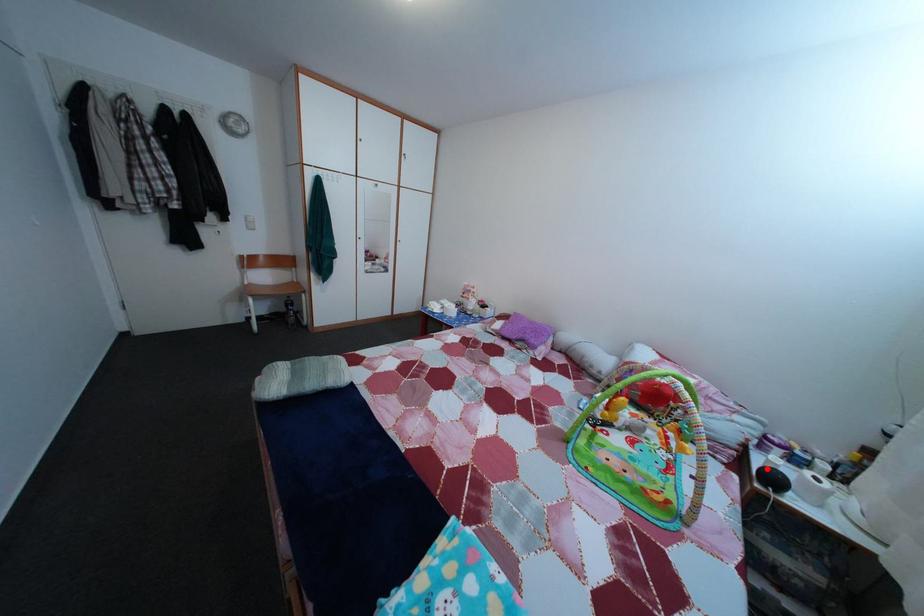
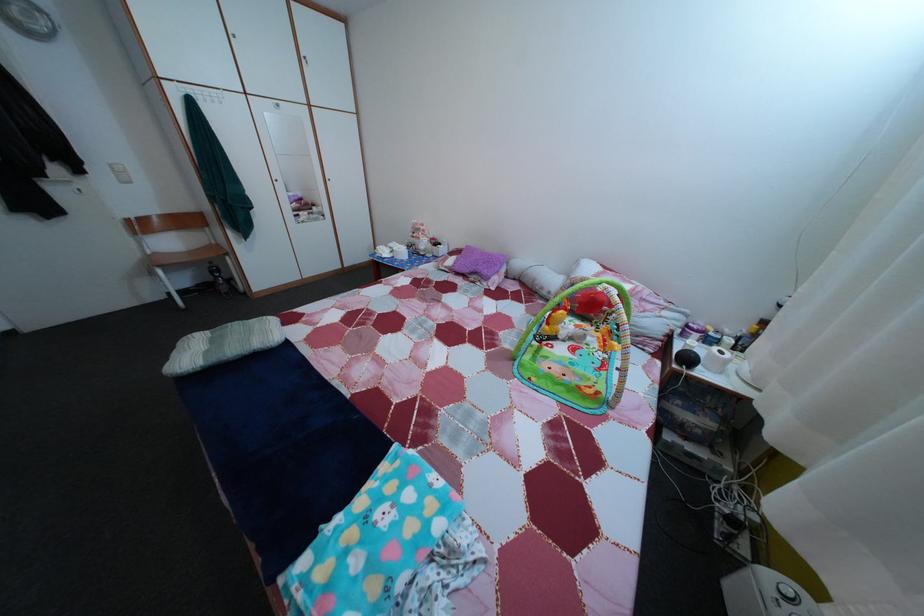
In the second image, find the point that corresponds to the highlighted location in the first image.

(687, 354)